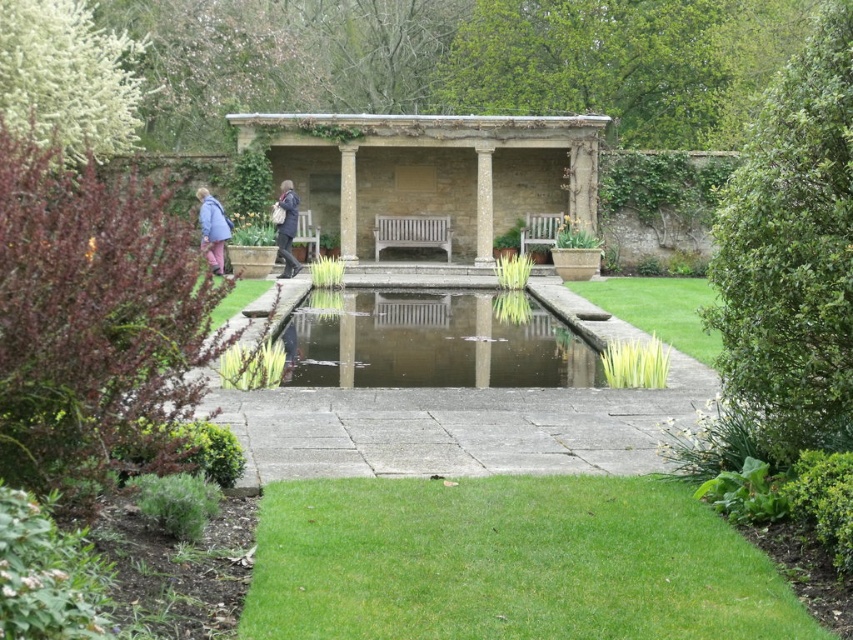
You are planning to place a small potted plant between the white stone column at center and the blue fabric coat at left. Based on their sizes, which object should the plant be closer to?

The white stone column at center is smaller than the blue fabric coat at left, so the plant should be placed closer to the white stone column at center to balance their sizes.

You are planning to place a decorative item between the white stone column at center and the blue fabric coat at left. Which object should you place closer to the narrower side to ensure stability?

The white stone column at center has a narrower width compared to the blue fabric coat at left, so placing the decorative item closer to the white stone column at center would provide better stability.

You are a visitor in the garden and see the white stone column at center and the blue fabric coat at left. Which object is located to the right of the other?

The white stone column at center is positioned on the right side of blue fabric coat at left.